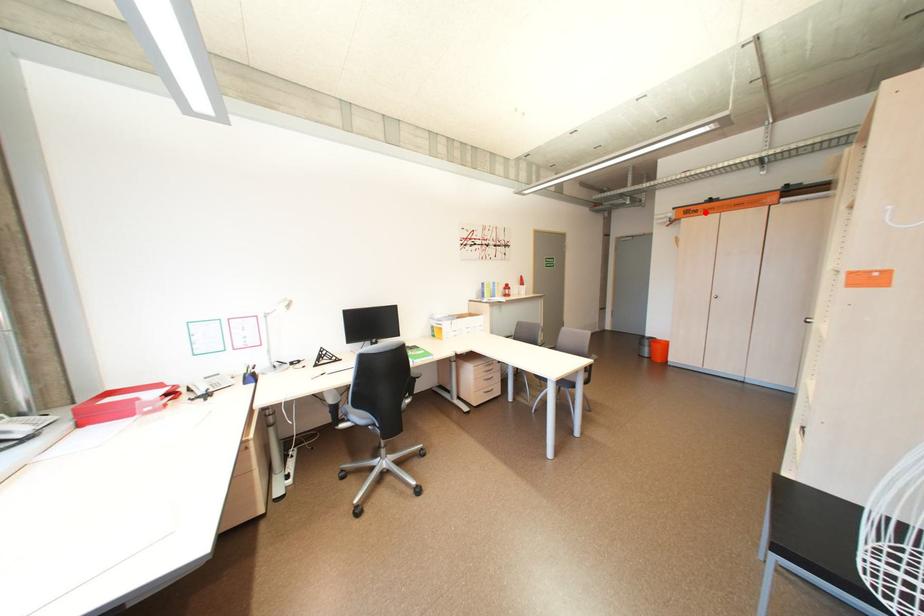
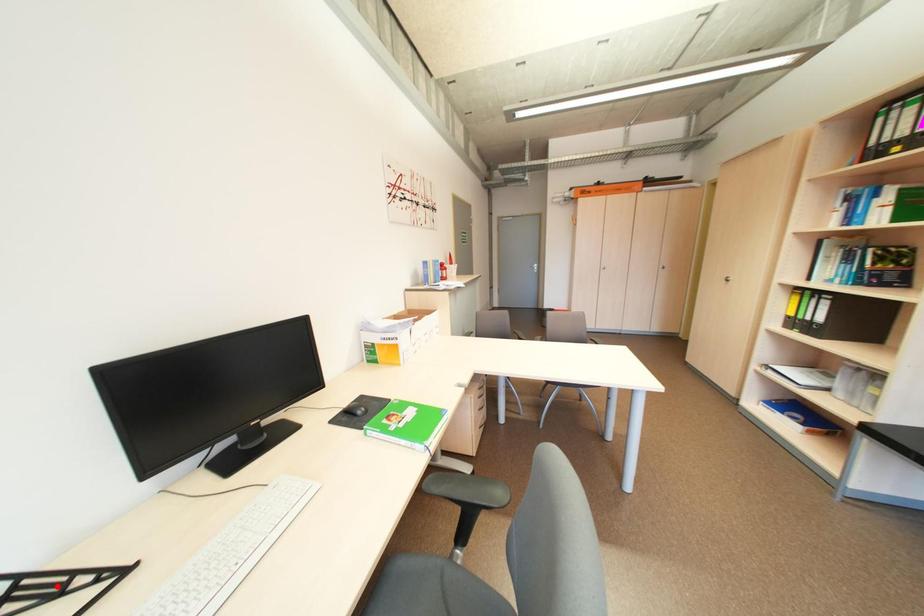
I am providing you with two images of the same scene from different viewpoints. A red point is marked on the first image and another point is marked on the second image. Is the red point in image1 aligned with the point shown in image2?

No